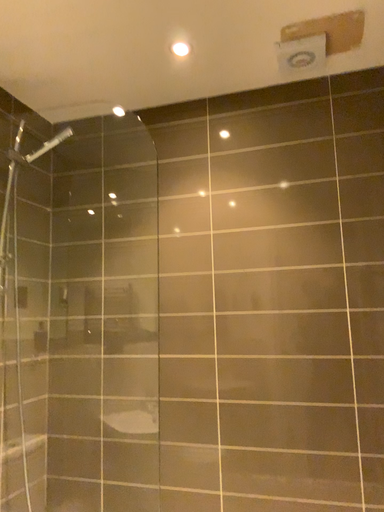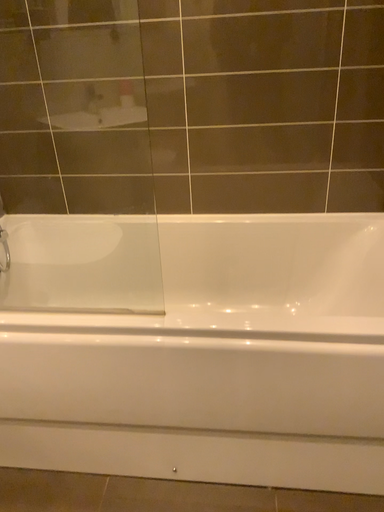
Question: Which way did the camera rotate in the video?

Choices:
 (A) rotated upward
 (B) rotated downward

Answer: (B)